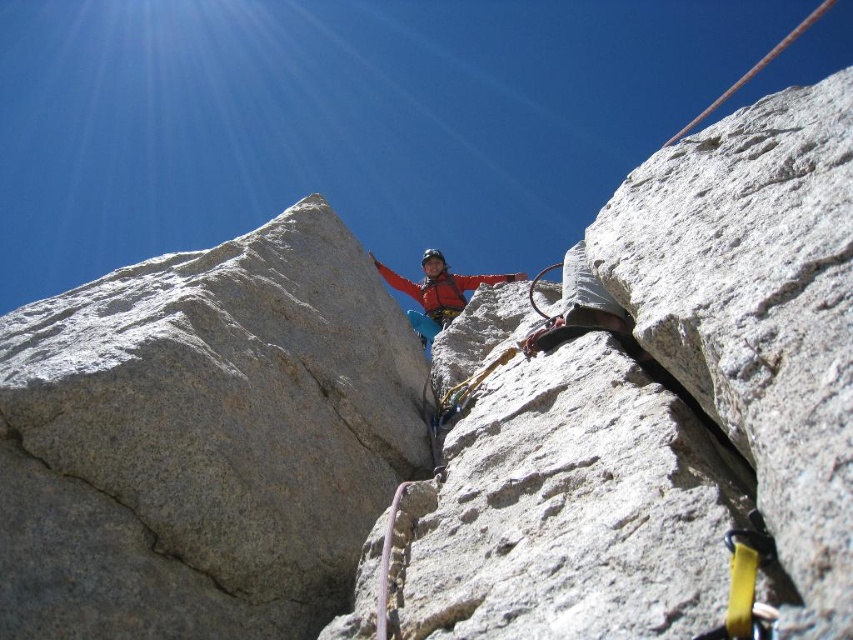
Which is more to the left, white granite rock at center or gray granite rock at center?

From the viewer's perspective, gray granite rock at center appears more on the left side.

Is point (554, 433) behind point (271, 298)?

No, (554, 433) is in front of (271, 298).

Who is more distant from viewer, [634,184] or [136,584]?

The point [634,184] is behind.

Where is `white granite rock at center`? The height and width of the screenshot is (640, 853). white granite rock at center is located at coordinates (666, 410).

Does white granite rock at center come behind matte red jacket at center?

No, white granite rock at center is closer to the viewer.

Does white granite rock at center have a greater height compared to matte red jacket at center?

Indeed, white granite rock at center has a greater height compared to matte red jacket at center.

What do you see at coordinates (666, 410) in the screenshot? The image size is (853, 640). I see `white granite rock at center` at bounding box center [666, 410].

Image resolution: width=853 pixels, height=640 pixels. I want to click on white granite rock at center, so click(x=666, y=410).

Who is shorter, gray granite rock at center or matte red jacket at center?

Standing shorter between the two is matte red jacket at center.

Is point (128, 353) positioned behind point (447, 305)?

No.

Locate an element on the screen. The height and width of the screenshot is (640, 853). gray granite rock at center is located at coordinates (202, 440).